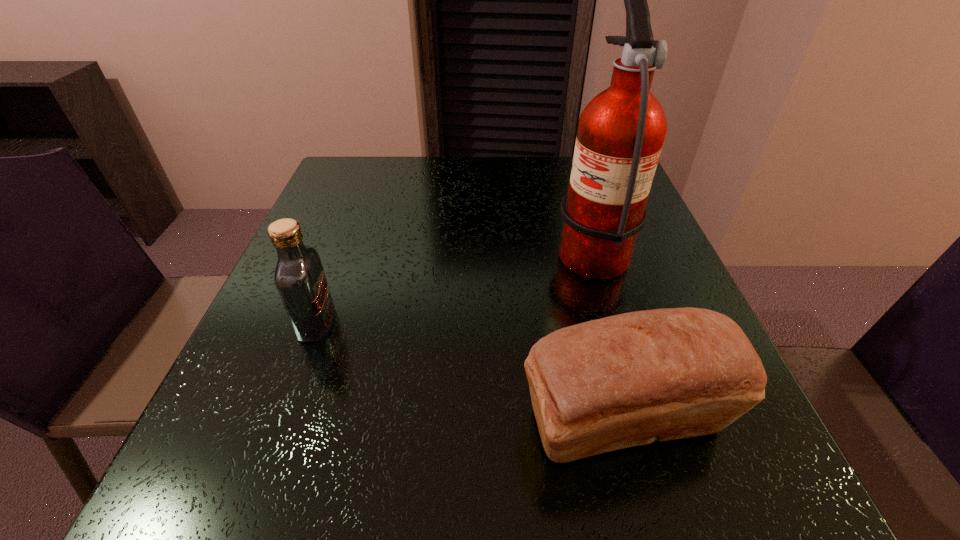
This screenshot has width=960, height=540. In order to click on vacant space located on the left of the shortest object in this screenshot , I will do `click(369, 420)`.

Identify the location of object present at the near edge. The height and width of the screenshot is (540, 960). (626, 380).

The image size is (960, 540). I want to click on object present at the left edge, so click(299, 276).

Where is `fire extinguisher at the right edge`? This screenshot has height=540, width=960. fire extinguisher at the right edge is located at coordinates (621, 131).

Identify the location of bread located in the right edge section of the desktop. The image size is (960, 540). (626, 380).

Locate an element on the screen. Image resolution: width=960 pixels, height=540 pixels. object present at the near right corner is located at coordinates (626, 380).

You are a GUI agent. You are given a task and a screenshot of the screen. Output one action in this format:
    pyautogui.click(x=<x>, y=<y>)
    Task: Click on the vacant space at the far edge of the desktop
    This screenshot has height=540, width=960.
    Given the screenshot: What is the action you would take?
    pyautogui.click(x=413, y=190)

This screenshot has width=960, height=540. In order to click on vacant space at the near edge of the desktop in this screenshot , I will do `click(638, 474)`.

In the image, there is a desktop. Where is `vacant area at the left edge`? vacant area at the left edge is located at coordinates (353, 297).

Where is `vacant space at the far left corner`? This screenshot has height=540, width=960. vacant space at the far left corner is located at coordinates (339, 202).